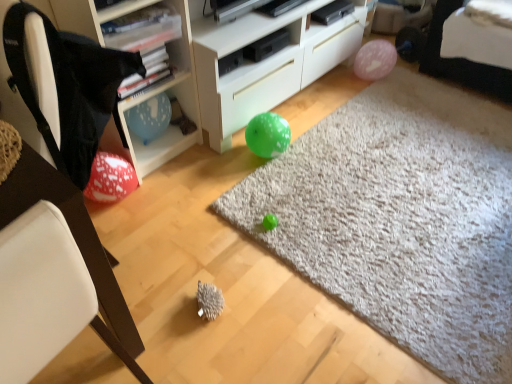
Locate an element on the screen. vacant space in between white matte cabinet at center and pink matte balloon at upper right is located at coordinates (325, 102).